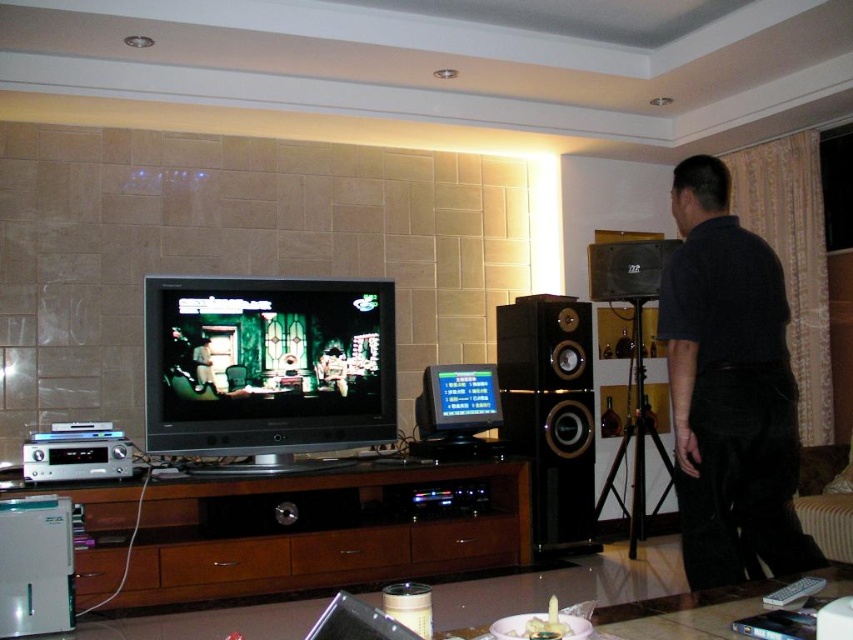
Question: Which of the following is the closest to the observer?

Choices:
 (A) (398, 554)
 (B) (381, 396)

Answer: (A)

Question: Which point appears closest to the camera in this image?

Choices:
 (A) (297, 433)
 (B) (699, 392)

Answer: (B)

Question: Does brown wood entertainment center at center appear on the right side of shiny black television at center?

Choices:
 (A) yes
 (B) no

Answer: (A)

Question: Is dark blue shirt at center thinner than black wood speaker at center?

Choices:
 (A) no
 (B) yes

Answer: (A)

Question: Which is nearer to the brown wood entertainment center at center?

Choices:
 (A) shiny black television at center
 (B) black wood speaker at center
 (C) dark blue shirt at center

Answer: (A)

Question: Is shiny black television at center wider than black wood speaker at center?

Choices:
 (A) no
 (B) yes

Answer: (B)